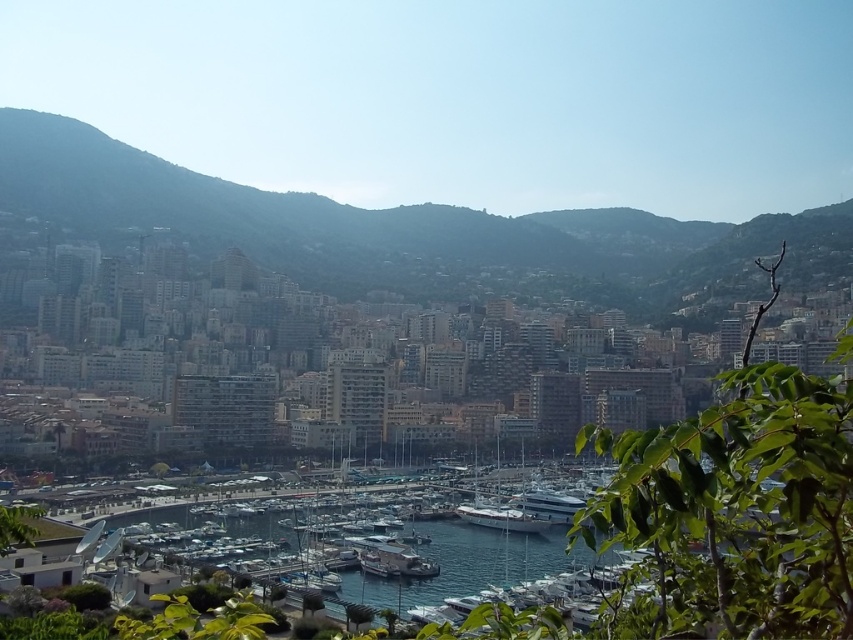
Question: Which point is closer to the camera taking this photo?

Choices:
 (A) (573, 232)
 (B) (491, 536)

Answer: (B)

Question: Does green textured hillside at center have a lesser width compared to clear blue water at lower center?

Choices:
 (A) yes
 (B) no

Answer: (B)

Question: Is green textured hillside at center below clear blue water at lower center?

Choices:
 (A) yes
 (B) no

Answer: (B)

Question: Is green textured hillside at center below clear blue water at lower center?

Choices:
 (A) yes
 (B) no

Answer: (B)